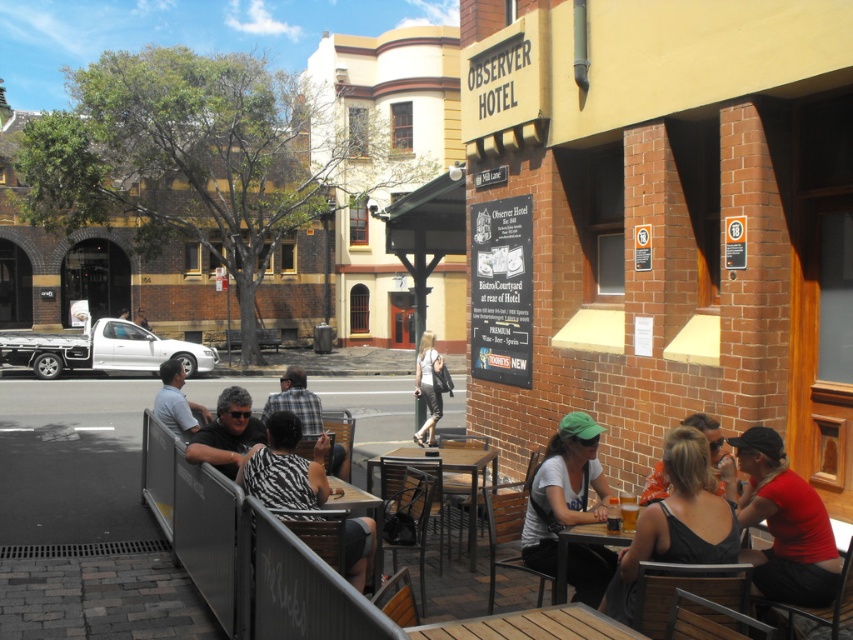
You are a photographer trying to capture a candid shot of the zebra print shirt at center and the matte black shirt at center. Since you want to focus on their clothing, which one should you adjust your camera focus to prioritize based on their height?

The zebra print shirt at center is much taller than the matte black shirt at center, so you should prioritize focusing on the zebra print shirt at center to ensure its details are sharp.

You are a photographer at the Observer Hotel and need to capture a photo of the zebra print shirt at center and matte black shirt at center. Which shirt should you focus on if you want to highlight the narrower silhouette?

The zebra print shirt at center is thinner than the matte black shirt at center, so you should focus on the zebra print shirt at center to highlight the narrower silhouette.

You are a photographer standing at the entrance of the Observer Hotel. You want to take a photo of both the black fabric tank top at lower right and the zebra print shirt at center. Can you fit both subjects into your camera frame if your camera has a maximum viewing distance of 10 feet?

The distance between the black fabric tank top at lower right and the zebra print shirt at center is 9.44 feet, which is within the camera frame limit of 10 feet. Therefore, both subjects can be captured in the same photo.